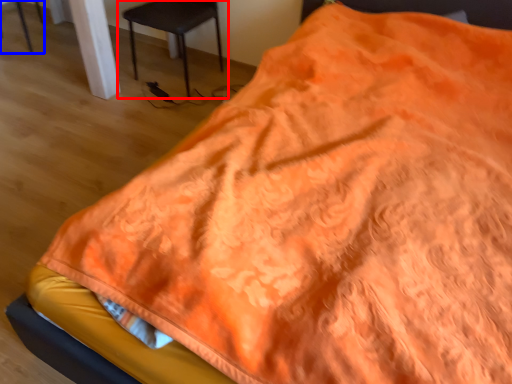
Question: Which point is closer to the camera, chair (highlighted by a red box) or chair (highlighted by a blue box)?

Choices:
 (A) chair
 (B) chair

Answer: (A)